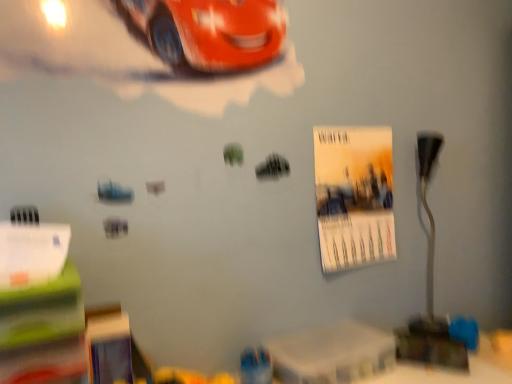
Question: Considering the relative sizes of matte paper poster at center right and metallic silver table lamp at right in the image provided, is matte paper poster at center right taller than metallic silver table lamp at right?

Choices:
 (A) no
 (B) yes

Answer: (A)

Question: Is matte paper poster at center right further to the viewer compared to metallic silver table lamp at right?

Choices:
 (A) yes
 (B) no

Answer: (B)

Question: Can you confirm if matte paper poster at center right is positioned to the left of metallic silver table lamp at right?

Choices:
 (A) yes
 (B) no

Answer: (A)

Question: Does matte paper poster at center right have a lesser width compared to metallic silver table lamp at right?

Choices:
 (A) no
 (B) yes

Answer: (B)

Question: Is there a large distance between matte paper poster at center right and metallic silver table lamp at right?

Choices:
 (A) no
 (B) yes

Answer: (A)

Question: From their relative heights in the image, would you say white plastic table at lower center is taller or shorter than metallic silver table lamp at right?

Choices:
 (A) short
 (B) tall

Answer: (A)

Question: Does point (324, 367) appear closer or farther from the camera than point (428, 210)?

Choices:
 (A) closer
 (B) farther

Answer: (A)

Question: From a real-world perspective, is white plastic table at lower center physically located above or below metallic silver table lamp at right?

Choices:
 (A) below
 (B) above

Answer: (A)

Question: In the image, is white plastic table at lower center positioned in front of or behind metallic silver table lamp at right?

Choices:
 (A) behind
 (B) front

Answer: (B)

Question: Considering the positions of white plastic table at lower center and matte paper poster at center right in the image, is white plastic table at lower center bigger or smaller than matte paper poster at center right?

Choices:
 (A) small
 (B) big

Answer: (A)

Question: Relative to matte paper poster at center right, is white plastic table at lower center in front or behind?

Choices:
 (A) behind
 (B) front

Answer: (B)

Question: Is white plastic table at lower center wider or thinner than matte paper poster at center right?

Choices:
 (A) thin
 (B) wide

Answer: (B)

Question: From the image's perspective, is white plastic table at lower center positioned above or below matte paper poster at center right?

Choices:
 (A) above
 (B) below

Answer: (B)

Question: From a real-world perspective, is metallic silver table lamp at right physically located above or below white plastic table at lower center?

Choices:
 (A) below
 (B) above

Answer: (B)

Question: Would you say metallic silver table lamp at right is to the left or to the right of white plastic table at lower center in the picture?

Choices:
 (A) left
 (B) right

Answer: (B)